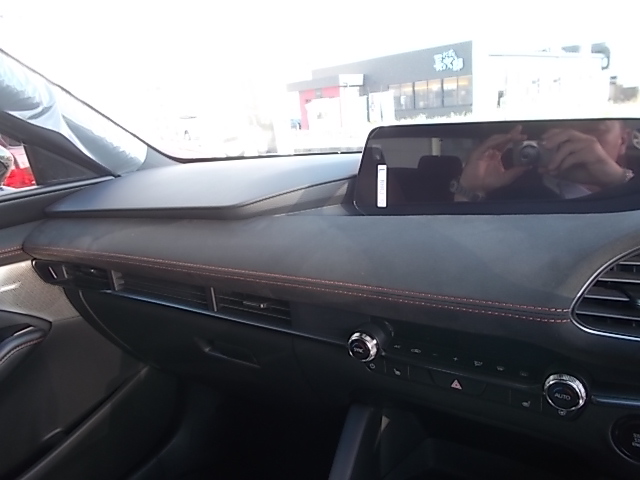
Find the location of a particular element. The image size is (640, 480). inside of door is located at coordinates (61, 386).